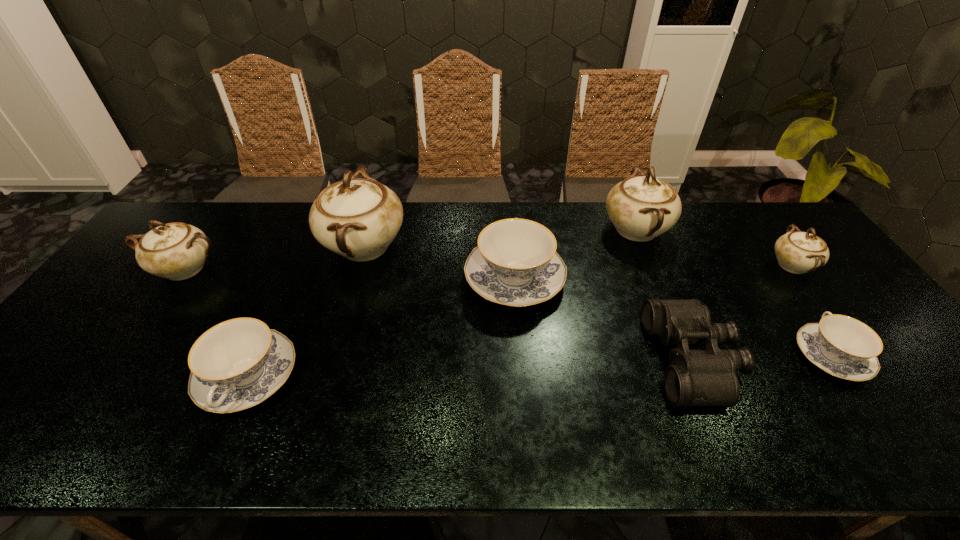
Locate which white chinaware ranks second in proximity to the tallest object. Please provide its 2D coordinates. Your answer should be formatted as a tuple, i.e. [(x, y)], where the tuple contains the x and y coordinates of a point satisfying the conditions above.

[(641, 208)]

Identify which blue chinaware is located as the second nearest to the shortest object. Please provide its 2D coordinates. Your answer should be formatted as a tuple, i.e. [(x, y)], where the tuple contains the x and y coordinates of a point satisfying the conditions above.

[(237, 364)]

This screenshot has width=960, height=540. In order to click on blue chinaware that stands as the closest to the rightmost blue chinaware in this screenshot , I will do `click(516, 264)`.

Find the location of a particular element. This screenshot has width=960, height=540. vacant area that satisfies the following two spatial constraints: 1. with the handle on the side of the fifth object from right to left; 2. on the left side of the smallest white chinaware is located at coordinates (514, 266).